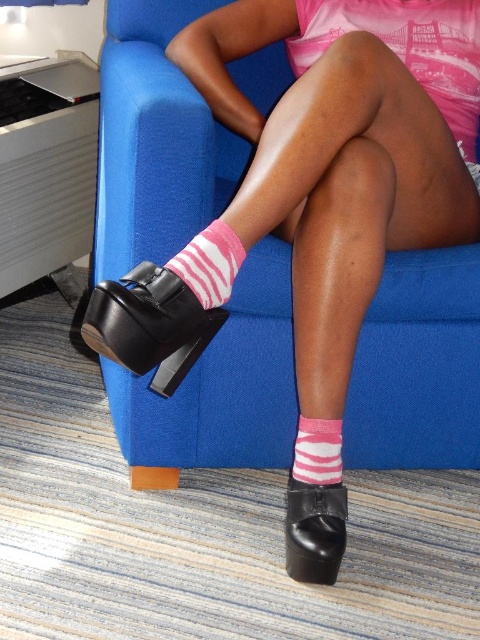
Which is more to the right, black leather shoe at lower center or pink striped sock at center?

black leather shoe at lower center

Who is taller, black leather shoe at lower center or pink striped sock at center?

black leather shoe at lower center is taller.

Is point (304, 563) less distant than point (231, 264)?

No, it is not.

Find the location of a particular element. Image resolution: width=480 pixels, height=640 pixels. black leather shoe at lower center is located at coordinates (314, 531).

The image size is (480, 640). What are the coordinates of `black leather shoe at lower left` in the screenshot? It's located at click(149, 324).

The height and width of the screenshot is (640, 480). Describe the element at coordinates (149, 324) in the screenshot. I see `black leather shoe at lower left` at that location.

Which is in front, point (153, 320) or point (316, 481)?

Point (153, 320) is more forward.

Where is `black leather shoe at lower left`? black leather shoe at lower left is located at coordinates (149, 324).

Can you confirm if black leather shoe at lower left is thinner than pink striped sock at center?

No, black leather shoe at lower left is not thinner than pink striped sock at center.

Which is more to the left, black leather shoe at lower left or pink striped sock at center?

black leather shoe at lower left

Is point (154, 348) farther from viewer compared to point (210, 230)?

No, (154, 348) is in front of (210, 230).

Where is `black leather shoe at lower left`? This screenshot has height=640, width=480. black leather shoe at lower left is located at coordinates [149, 324].